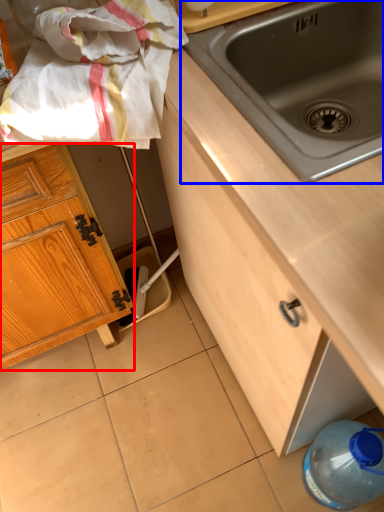
Question: Which of the following is the farthest to the observer, cabinetry (highlighted by a red box) or sink (highlighted by a blue box)?

Choices:
 (A) cabinetry
 (B) sink

Answer: (A)